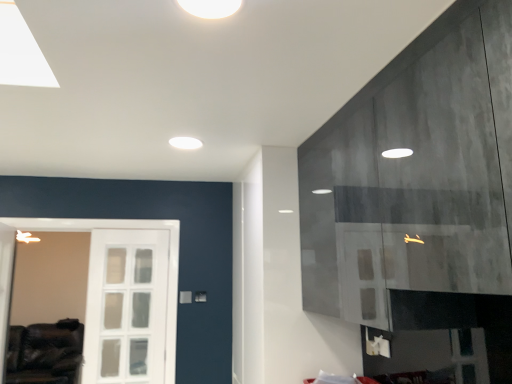
Question: Is white matte ceiling light at upper center, which is the second lighting from top to bottom, taller or shorter than white matte light fixture at upper center, which ranks as the second lighting in bottom-to-top order?

Choices:
 (A) short
 (B) tall

Answer: (A)

Question: Considering the positions of white matte ceiling light at upper center, the 2th lighting positioned from the right, and white matte light fixture at upper center, the 2th lighting when ordered from left to right, in the image, is white matte ceiling light at upper center, the 2th lighting positioned from the right, bigger or smaller than white matte light fixture at upper center, the 2th lighting when ordered from left to right,?

Choices:
 (A) small
 (B) big

Answer: (B)

Question: Which object is positioned farthest from the white matte ceiling light at upper center, positioned as the 2th lighting in front-to-back order?

Choices:
 (A) white matte light fixture at upper center, which appears as the second lighting when viewed from the back
 (B) leather couch at lower left

Answer: (B)

Question: Considering the real-world distances, which object is farthest from the white matte light fixture at upper center, which ranks as the 1th lighting in front-to-back order?

Choices:
 (A) leather couch at lower left
 (B) white matte ceiling light at upper center, the 1th lighting in the back-to-front sequence

Answer: (A)